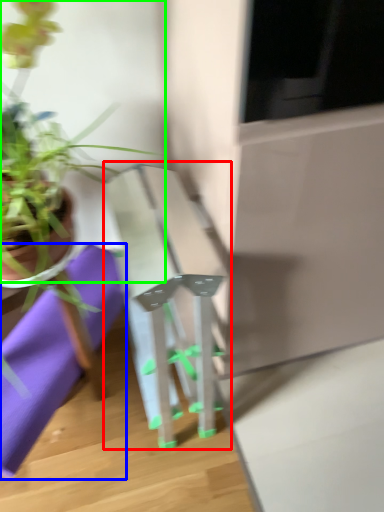
Question: Based on their relative distances, which object is nearer to table (highlighted by a red box)? Choose from cloth (highlighted by a blue box) and houseplant (highlighted by a green box).

Choices:
 (A) cloth
 (B) houseplant

Answer: (A)